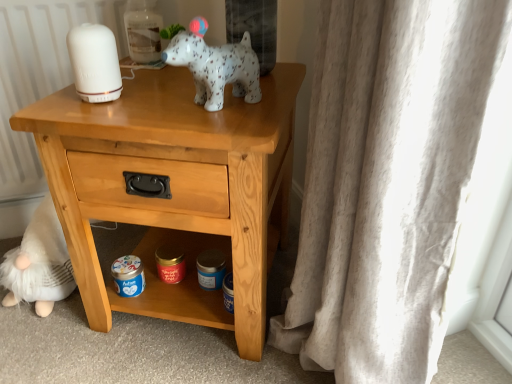
What are the coordinates of `vacant area that lies between white speckled ceramic dog at upper center and white matte bottle at upper center` in the screenshot? It's located at (159, 80).